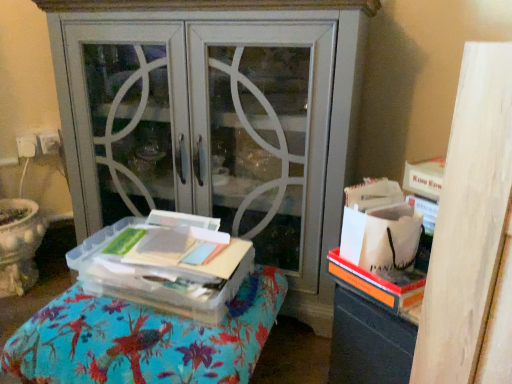
The height and width of the screenshot is (384, 512). What are the coordinates of `free spot in front of clear plastic container at center` in the screenshot? It's located at (148, 346).